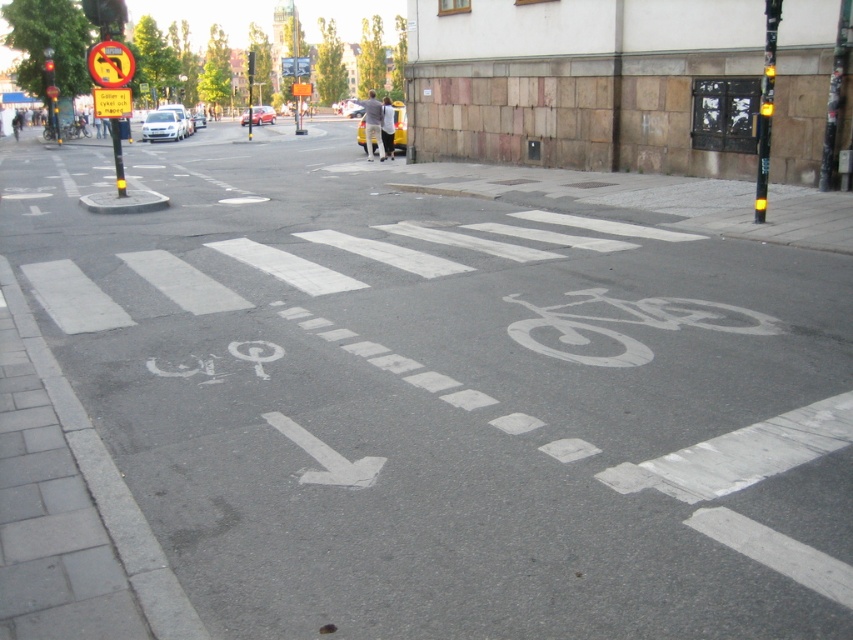
Does white glossy car at center-left have a smaller size compared to yellow matte car at center?

Yes.

Can you confirm if white glossy car at center-left is thinner than yellow matte car at center?

Correct, white glossy car at center-left's width is less than yellow matte car at center's.

Find the location of `white glossy car at center-left`. white glossy car at center-left is located at coordinates (161, 125).

Can you confirm if yellow reflective circular sign at upper left is positioned below yellow matte car at center?

Indeed, yellow reflective circular sign at upper left is positioned under yellow matte car at center.

Can you confirm if yellow reflective circular sign at upper left is smaller than yellow matte car at center?

Indeed, yellow reflective circular sign at upper left has a smaller size compared to yellow matte car at center.

Which is in front, point (107, 84) or point (398, 131)?

Point (107, 84)

The image size is (853, 640). I want to click on yellow reflective circular sign at upper left, so click(x=109, y=64).

Can you confirm if yellow reflective circular sign at upper left is bigger than red glass traffic light at upper left?

Actually, yellow reflective circular sign at upper left might be smaller than red glass traffic light at upper left.

Can you confirm if yellow reflective circular sign at upper left is taller than red glass traffic light at upper left?

No, yellow reflective circular sign at upper left is not taller than red glass traffic light at upper left.

Identify the location of yellow reflective circular sign at upper left. The width and height of the screenshot is (853, 640). (109, 64).